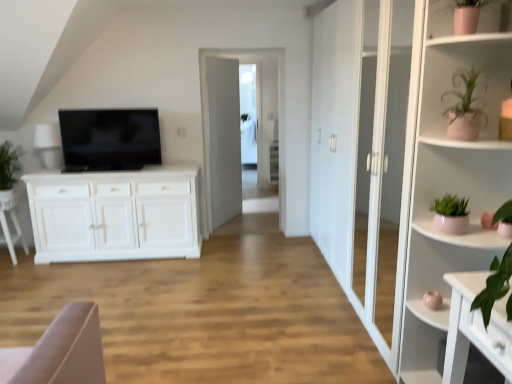
Question: From their relative heights in the image, would you say pink ceramic vase at upper right, which is the first shelf in top-to-bottom order, is taller or shorter than pink ceramic plant at upper right?

Choices:
 (A) tall
 (B) short

Answer: (B)

Question: Would you say pink ceramic vase at upper right, the 2th shelf in the bottom-to-top sequence, is to the left or to the right of pink ceramic plant at upper right in the picture?

Choices:
 (A) left
 (B) right

Answer: (A)

Question: Which is farther from the white wooden door at center?

Choices:
 (A) pink ceramic plant at upper right
 (B) white wood armchair at left
 (C) pink ceramic plant at right, which is the first shelf in bottom-to-top order
 (D) transparent glass door at center
 (E) pink ceramic vase at upper right, which is the first shelf in top-to-bottom order

Answer: (E)

Question: Which of these objects is positioned farthest from the pink ceramic plant at right, which is the 2th shelf from top to bottom?

Choices:
 (A) white wood armchair at left
 (B) transparent glass door at center
 (C) pink ceramic vase at upper right, which is the first shelf in top-to-bottom order
 (D) white wooden door at center
 (E) pink ceramic plant at upper right

Answer: (A)